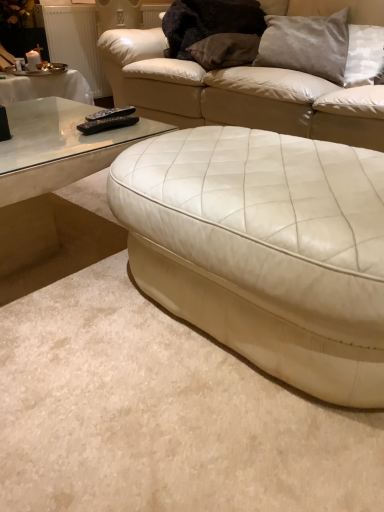
Find the location of a particular element. free space above white leather ottoman at center, which is the first studio couch in front-to-back order (from a real-world perspective) is located at coordinates (265, 172).